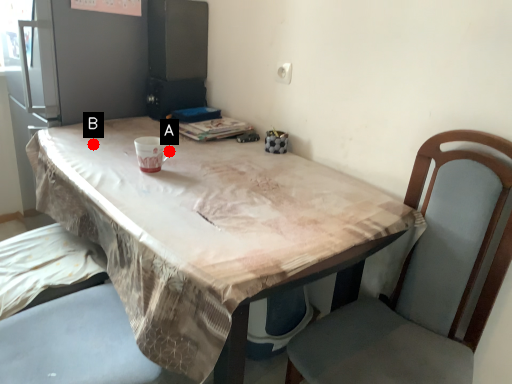
Question: Two points are circled on the image, labeled by A and B beside each circle. Which of the following is the farthest from the observer?

Choices:
 (A) A is further
 (B) B is further

Answer: (B)